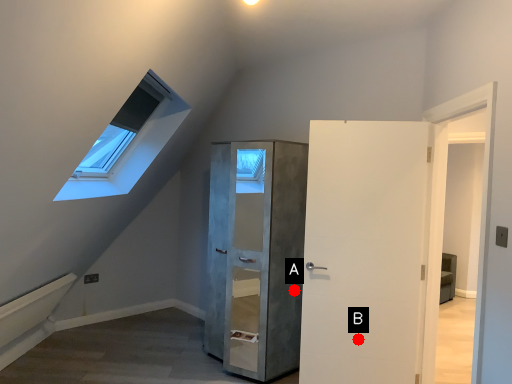
Question: Two points are circled on the image, labeled by A and B beside each circle. Which of the following is the farthest from the observer?

Choices:
 (A) A is further
 (B) B is further

Answer: (A)